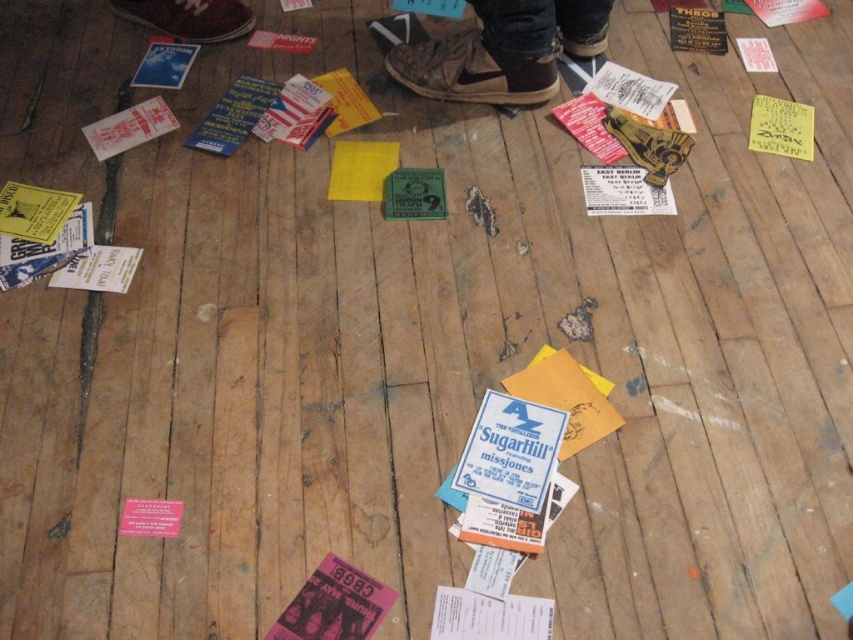
You are trying to determine if the brown suede shoes at upper center can be placed on top of the white paper at left without folding it. Based on their sizes, is this possible?

The brown suede shoes at upper center has a greater height compared to white paper at left, so placing them on top would likely cause the paper to fold or crumple due to the height difference.

Looking at this image, you are a janitor trying to clean up the white paper at upper left and the white paper at left. If your cleaning tool has a maximum reach of 15 inches, can you collect both papers without moving from your current position?

The white paper at upper left is 14.71 inches away from the white paper at left. Since your tool can reach up to 15 inches, you can collect both papers without moving from your current position.

You are standing on the wooden floor and see the yellow paper at upper right and the white paper at left. Which paper is closer to you?

The yellow paper at upper right is closer to you because it is further to the viewer than the white paper at left.